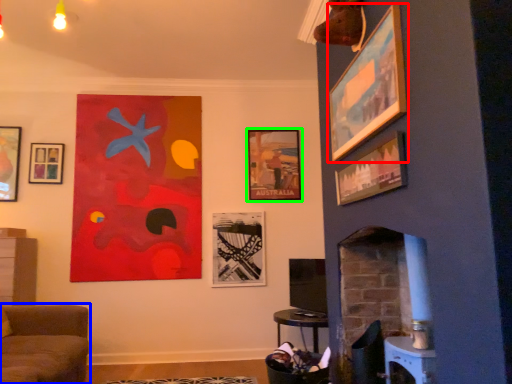
Question: Which object is positioned farthest from picture frame (highlighted by a red box)? Select from furniture (highlighted by a blue box) and picture frame (highlighted by a green box).

Choices:
 (A) furniture
 (B) picture frame

Answer: (A)